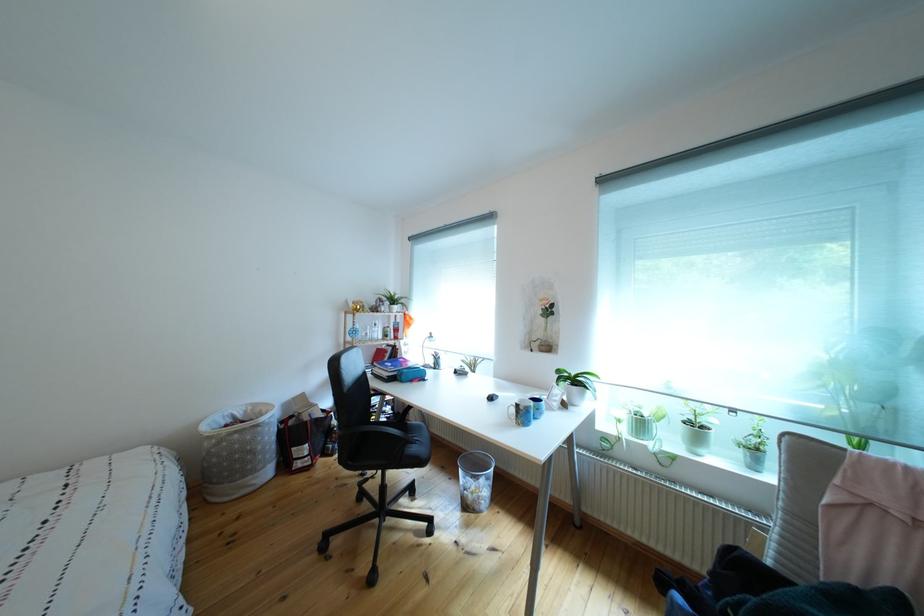
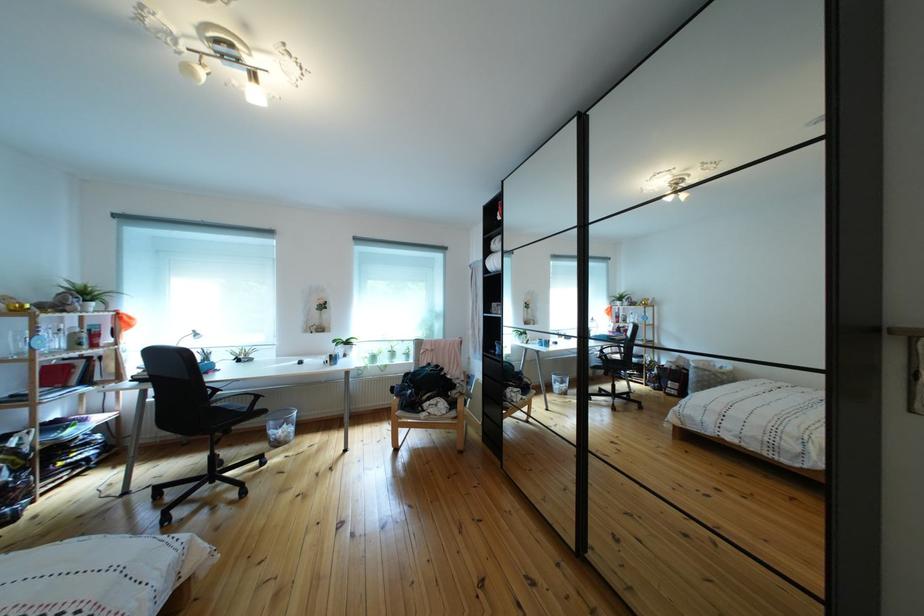
Locate, in the second image, the point that corresponds to (x=472, y=477) in the first image.

(283, 430)